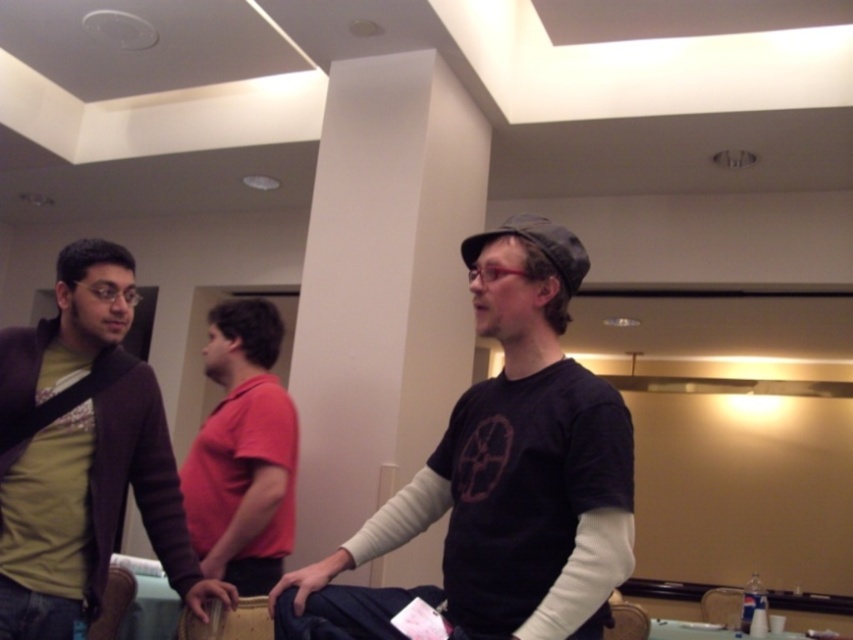
Question: Estimate the real-world distances between objects in this image. Which object is closer to the black matte shirt at center?

Choices:
 (A) matte blue jeans at lower center
 (B) green matte shirt at left
 (C) red cotton shirt at center
 (D) wooden textured hand at lower left

Answer: (A)

Question: Is matte blue jeans at lower center positioned in front of wooden textured hand at lower left?

Choices:
 (A) no
 (B) yes

Answer: (B)

Question: Which object is positioned farthest from the black matte shirt at center?

Choices:
 (A) red cotton shirt at center
 (B) matte blue jeans at lower center

Answer: (A)

Question: Observing the image, what is the correct spatial positioning of black matte shirt at center in reference to green matte shirt at left?

Choices:
 (A) right
 (B) left

Answer: (A)

Question: Based on their relative distances, which object is nearer to the matte blue jeans at lower center?

Choices:
 (A) black matte shirt at center
 (B) green matte shirt at left
 (C) red cotton shirt at center

Answer: (A)

Question: Can you confirm if black matte shirt at center is wider than green matte shirt at left?

Choices:
 (A) yes
 (B) no

Answer: (A)